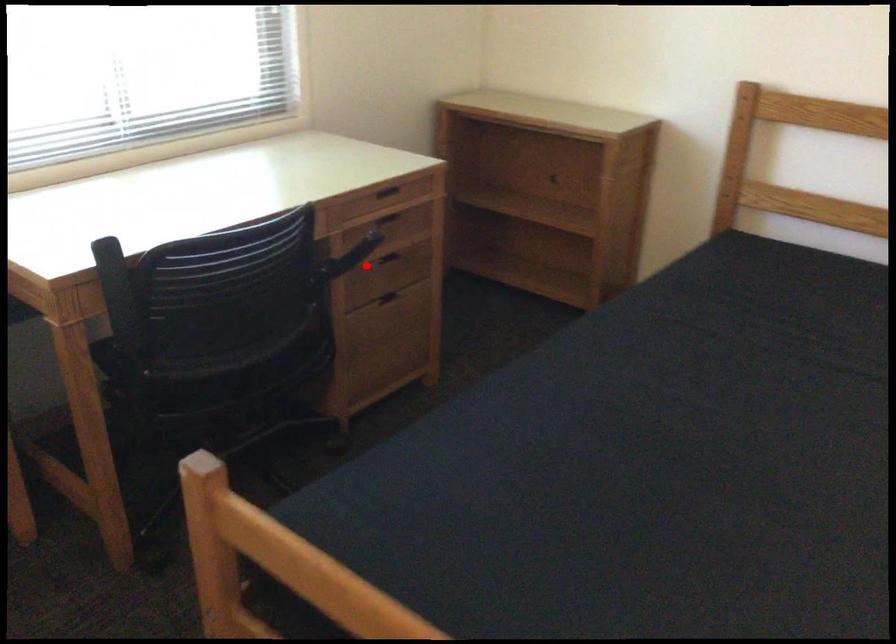
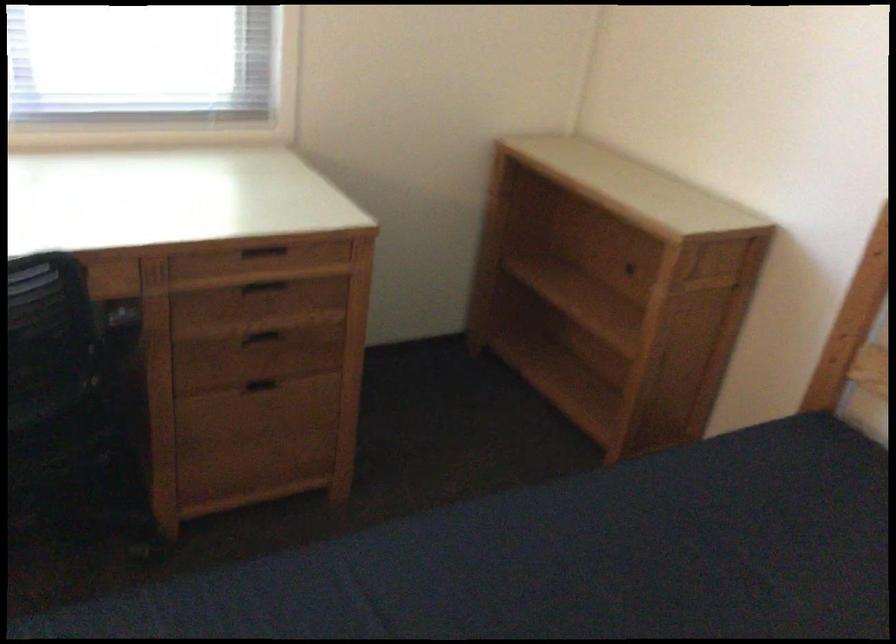
Question: A red point is marked in image1. In image2, is the corresponding 3D point closer to the camera or farther? Reply with the corresponding letter.

Choices:
 (A) The corresponding 3D point is closer.
 (B) The corresponding 3D point is farther.

Answer: (A)